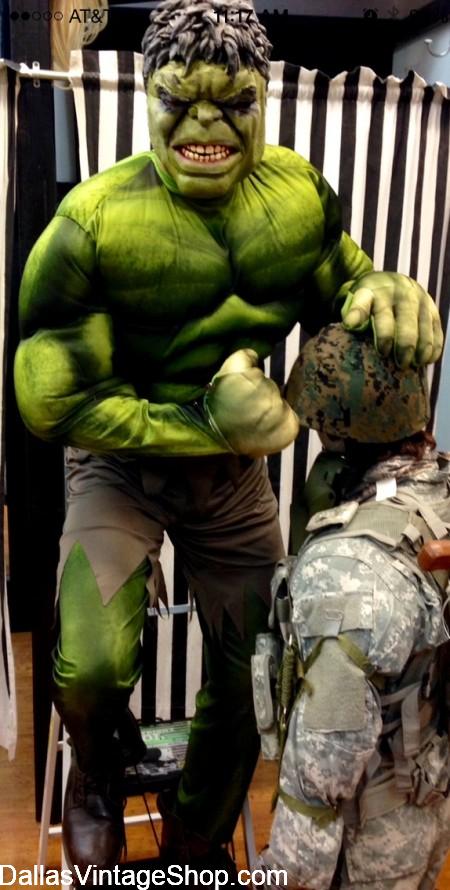
You are a GUI agent. You are given a task and a screenshot of the screen. Output one action in this format:
    pyautogui.click(x=<x>, y=<y>)
    Task: Click on the coat hook
    
    Given the screenshot: What is the action you would take?
    pyautogui.click(x=434, y=52)